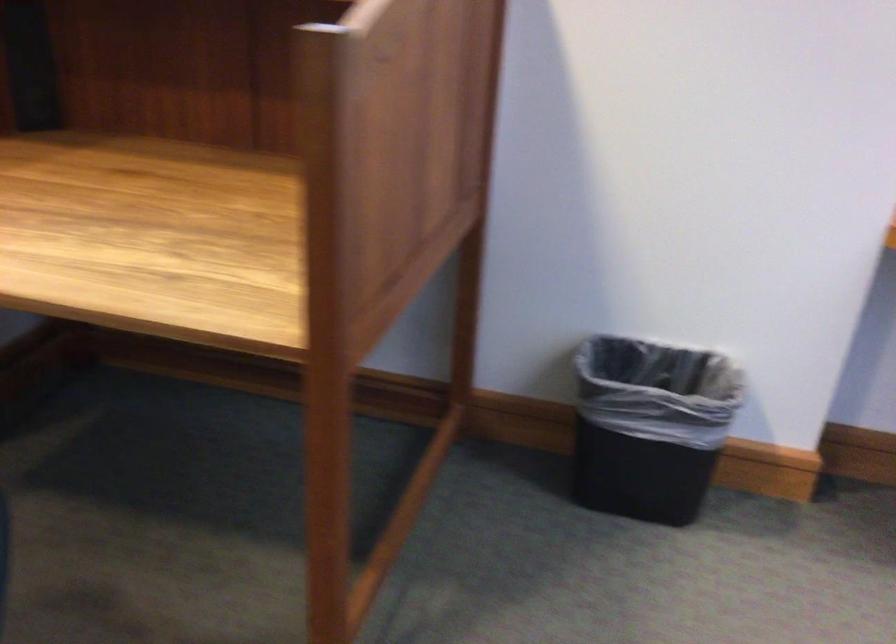
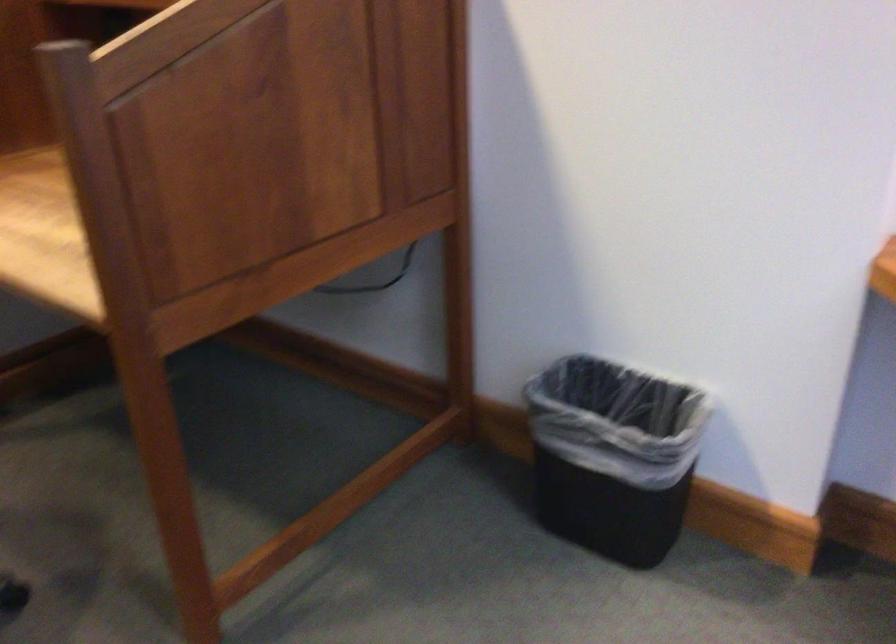
Question: Based on the continuous images, in which direction is the camera rotating? Reply with the corresponding letter.

Choices:
 (A) Left
 (B) Right
 (C) Up
 (D) Down

Answer: (A)